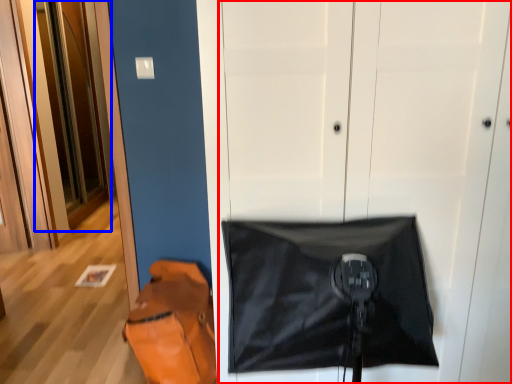
Question: Which of the following is the closest to the observer, door (highlighted by a red box) or door (highlighted by a blue box)?

Choices:
 (A) door
 (B) door

Answer: (A)